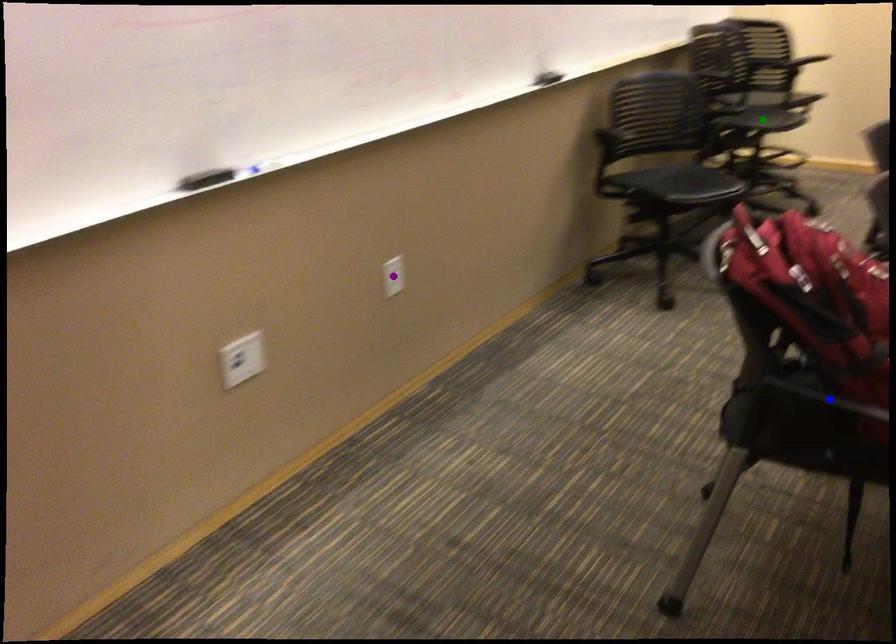
Order these from farthest to nearest:
1. purple point
2. green point
3. blue point

green point
purple point
blue point